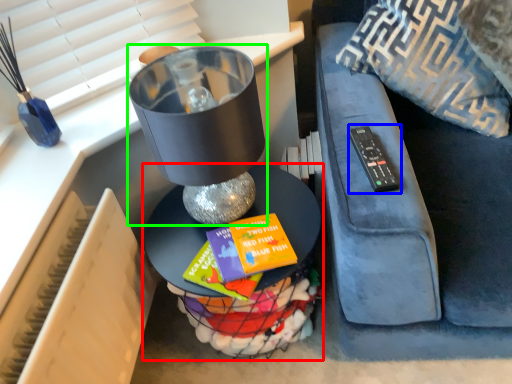
Question: Which is farther away from table (highlighted by a red box)? remote (highlighted by a blue box) or table lamp (highlighted by a green box)?

Choices:
 (A) remote
 (B) table lamp

Answer: (A)